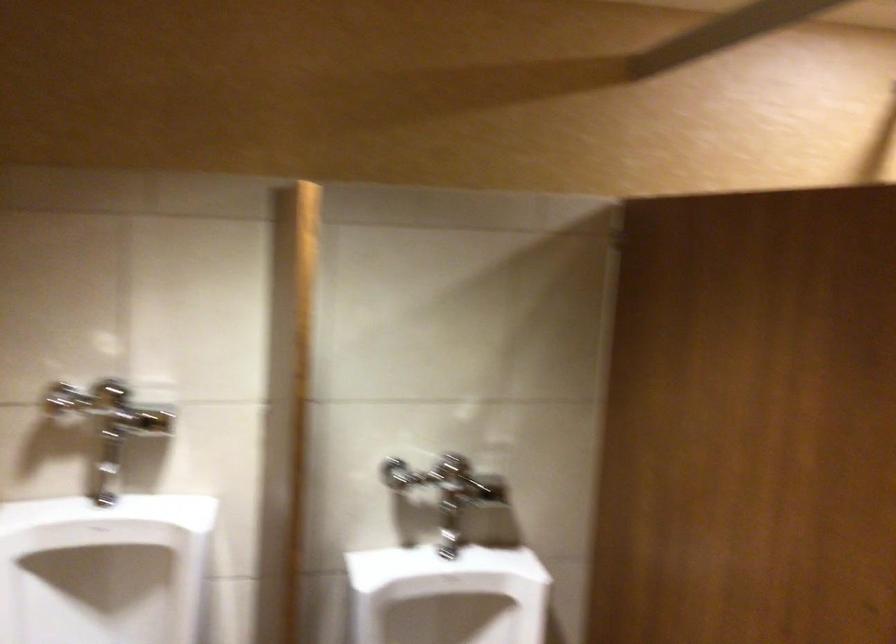
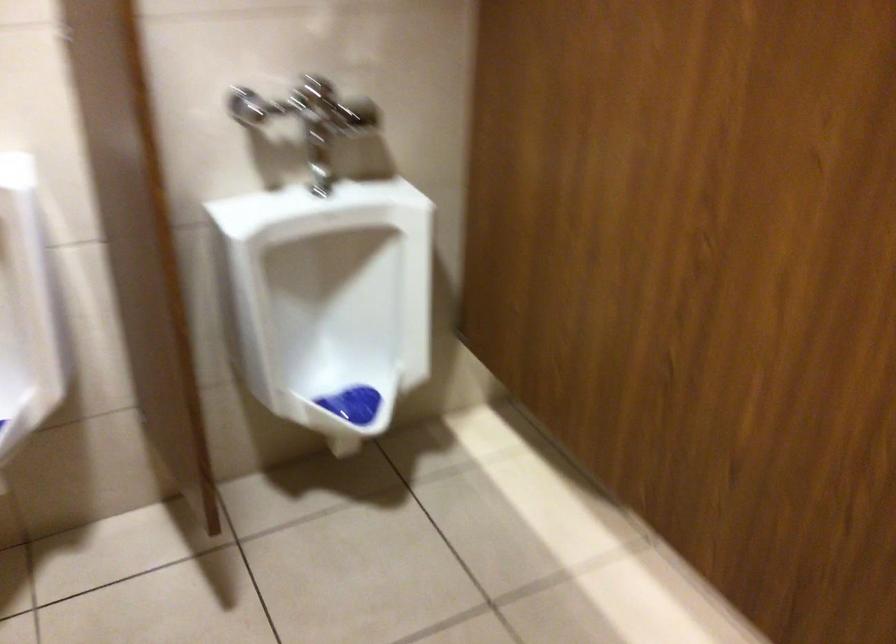
In a continuous first-person perspective shot, in which direction is the camera moving?

The cameraman moved toward left, forward.